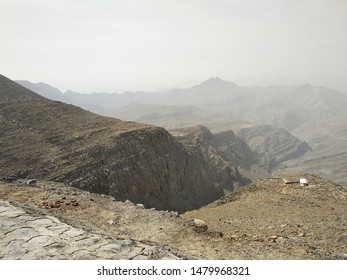
Locate an element on the screen. white bar is located at coordinates (270, 267), (70, 271).